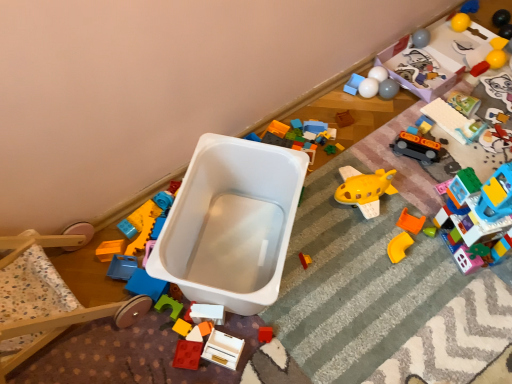
Where is `vacant area that is situated to the right of orange plastic block at lower right, placed as the 10th toy when sorted from left to right`? vacant area that is situated to the right of orange plastic block at lower right, placed as the 10th toy when sorted from left to right is located at coordinates (444, 232).